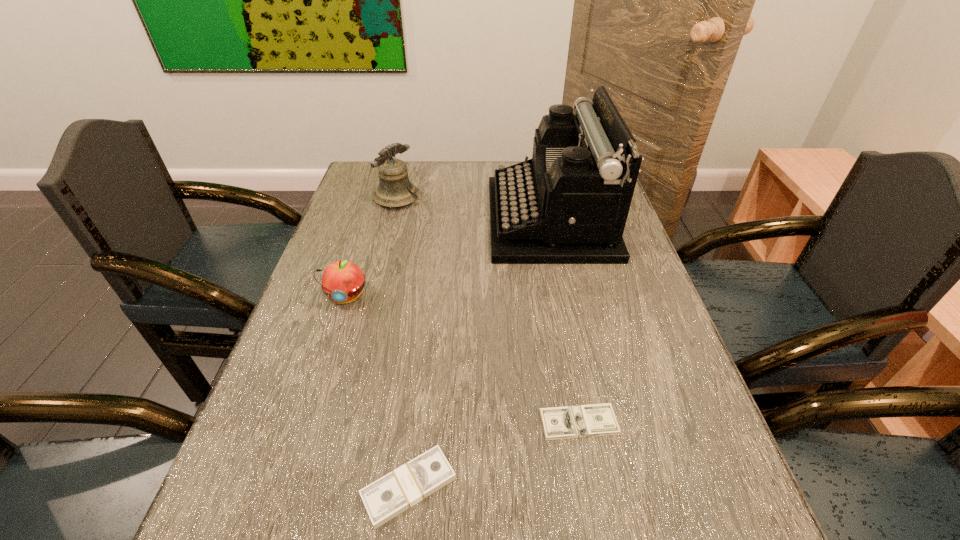
Locate an element on the screen. The image size is (960, 540). typewriter is located at coordinates (569, 204).

At what (x,y) coordinates should I click in order to perform the action: click on the fourth shortest object. Please return your answer as a coordinate pair (x, y). Looking at the image, I should click on (394, 190).

You are a GUI agent. You are given a task and a screenshot of the screen. Output one action in this format:
    pyautogui.click(x=<x>, y=<y>)
    Task: Click on the third nearest object
    
    Given the screenshot: What is the action you would take?
    point(342,281)

This screenshot has height=540, width=960. Identify the location of apple. (342, 281).

Identify the location of the second shortest object. (397, 491).

The height and width of the screenshot is (540, 960). Identify the location of the left dollar. (397, 491).

Locate an element on the screen. This screenshot has height=540, width=960. the farther dollar is located at coordinates (579, 421).

The width and height of the screenshot is (960, 540). I want to click on the shortest object, so click(x=579, y=421).

Identify the location of free location located on the typing side of the tallest object. (409, 219).

Identify the location of vacant space located on the typing side of the tallest object. (392, 219).